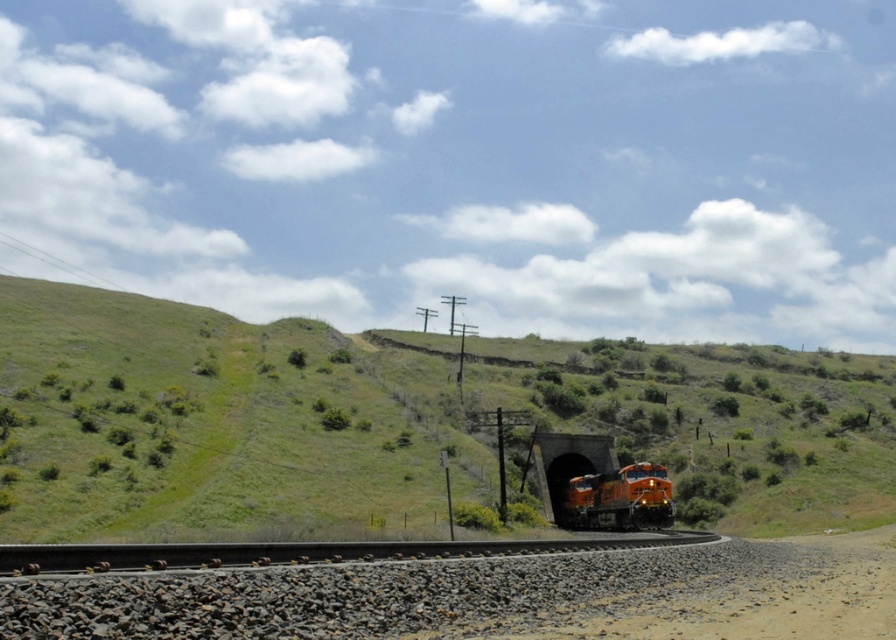
Question: Which object is the closest to the dark gray concrete tunnel at center?

Choices:
 (A) brown gravel dirt track at lower center
 (B) black asphalt track at center

Answer: (B)

Question: Which point is farther from the camera taking this photo?

Choices:
 (A) (696, 536)
 (B) (739, 632)
 (C) (41, 454)

Answer: (C)

Question: Is green grassy hillside at center positioned before brown gravel dirt track at lower center?

Choices:
 (A) no
 (B) yes

Answer: (A)

Question: Among these points, which one is farthest from the camera?

Choices:
 (A) (657, 518)
 (B) (552, 465)
 (C) (326, 561)

Answer: (B)

Question: Observing the image, what is the correct spatial positioning of green grassy hillside at center in reference to dark gray concrete tunnel at center?

Choices:
 (A) below
 (B) above

Answer: (B)

Question: Is brown gravel dirt track at lower center above orange metallic train at lower center?

Choices:
 (A) no
 (B) yes

Answer: (B)